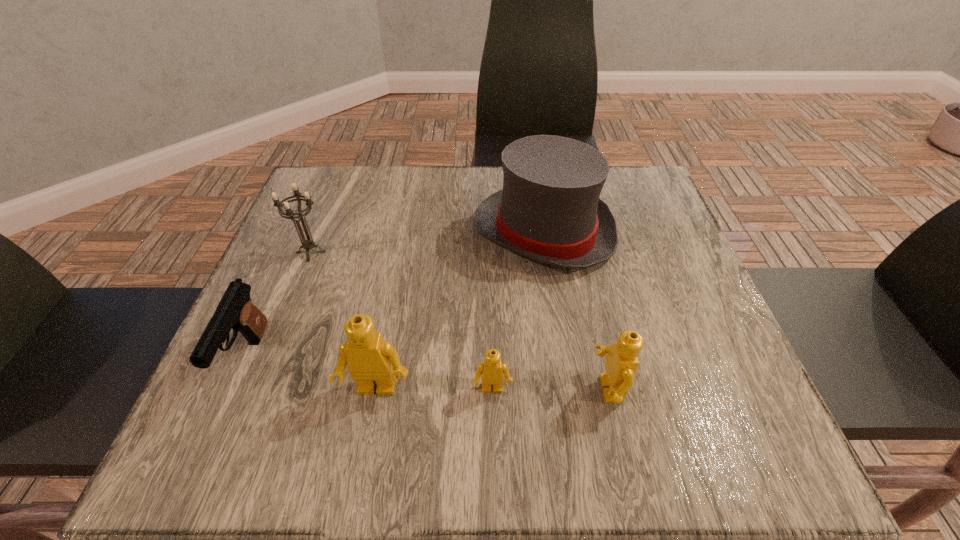
I want to click on blank space located on the right of the dress hat, so click(x=660, y=232).

Image resolution: width=960 pixels, height=540 pixels. Find the location of `vacant region located on the front of the candle holder`. vacant region located on the front of the candle holder is located at coordinates (275, 346).

Locate an element on the screen. The image size is (960, 540). object that is positioned at the far edge is located at coordinates (549, 210).

At what (x,y) coordinates should I click in order to perform the action: click on pistol that is at the near edge. Please return your answer as a coordinate pair (x, y). Looking at the image, I should click on (235, 310).

The height and width of the screenshot is (540, 960). Find the location of `candle holder that is at the left edge`. candle holder that is at the left edge is located at coordinates (308, 244).

Where is `pistol that is positioned at the left edge`? This screenshot has height=540, width=960. pistol that is positioned at the left edge is located at coordinates (235, 310).

The image size is (960, 540). Find the location of `object that is at the right edge`. object that is at the right edge is located at coordinates (549, 210).

Locate an element on the screen. The image size is (960, 540). object that is at the near left corner is located at coordinates (235, 310).

Identify the location of object located in the far right corner section of the desktop. click(549, 210).

In the image, there is a desktop. Where is `vacant area at the far edge`? The height and width of the screenshot is (540, 960). vacant area at the far edge is located at coordinates (460, 205).